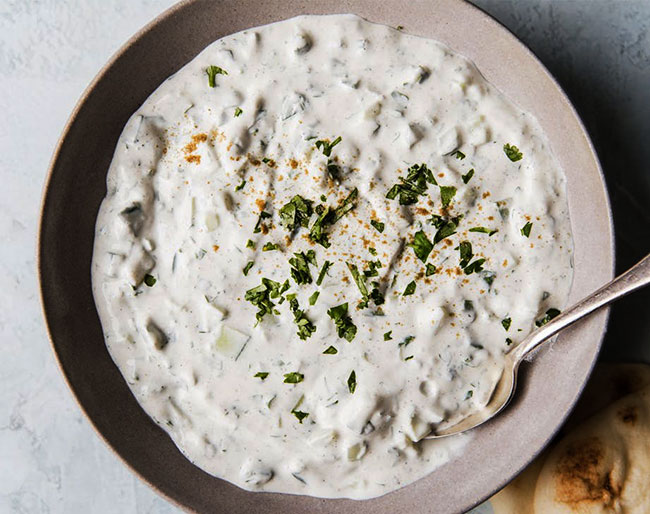
The height and width of the screenshot is (514, 650). What are the coordinates of `brown bowl in shadow` in the screenshot? It's located at (70, 305).